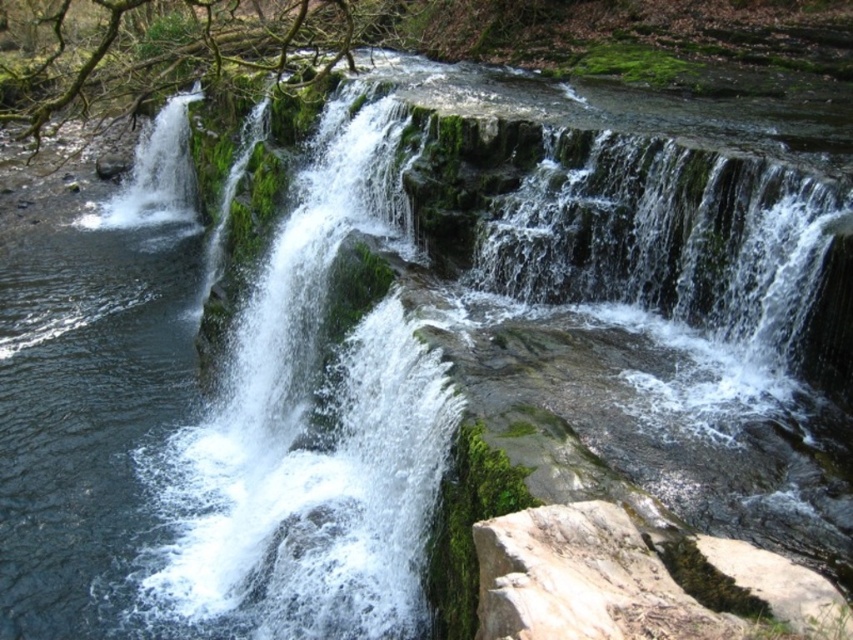
Question: Is white frothy water at left positioned in front of gray rough rock at lower right?

Choices:
 (A) yes
 (B) no

Answer: (B)

Question: Which object appears closest to the camera in this image?

Choices:
 (A) gray rough rock at lower right
 (B) white frothy water at left

Answer: (A)

Question: Among these objects, which one is farthest from the camera?

Choices:
 (A) gray rough rock at lower right
 (B) white frothy water at left

Answer: (B)

Question: Is white frothy water at left above gray rough rock at lower right?

Choices:
 (A) no
 (B) yes

Answer: (B)

Question: Which object appears farthest from the camera in this image?

Choices:
 (A) white frothy water at left
 (B) gray rough rock at lower right

Answer: (A)

Question: Is white frothy water at left above gray rough rock at lower right?

Choices:
 (A) yes
 (B) no

Answer: (A)